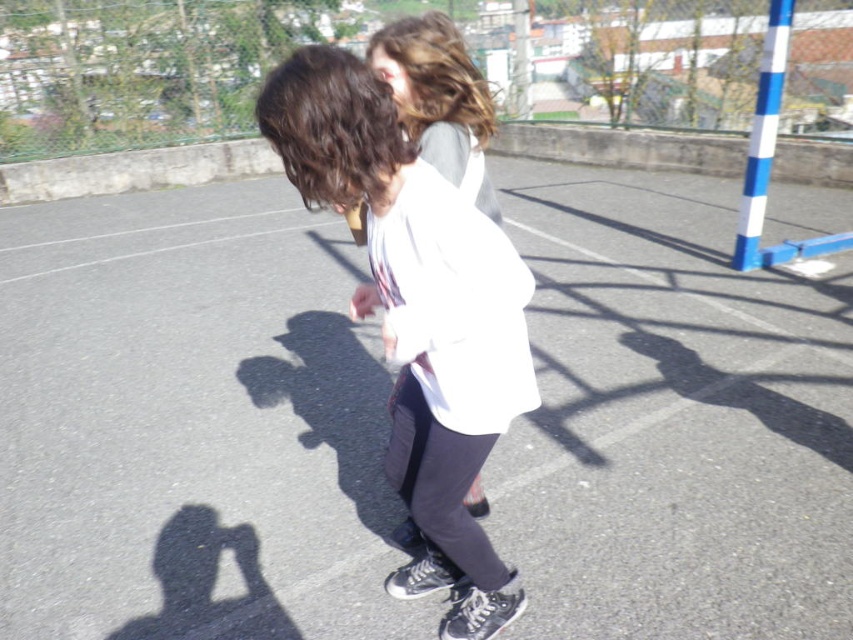
Is point (329, 156) positioned after point (473, 81)?

That is False.

Is white matte jacket at center shorter than white fabric at center?

In fact, white matte jacket at center may be taller than white fabric at center.

Between point (466, 216) and point (431, 161), which one is positioned behind?

The point (431, 161) is more distant.

I want to click on white matte jacket at center, so click(x=418, y=316).